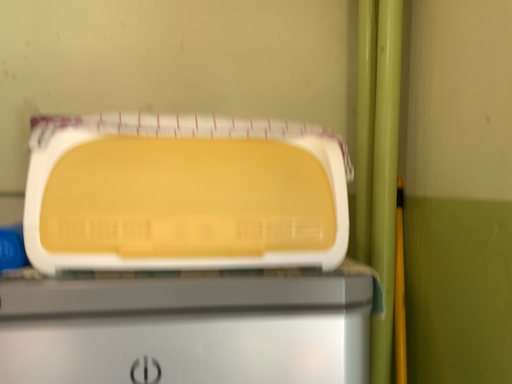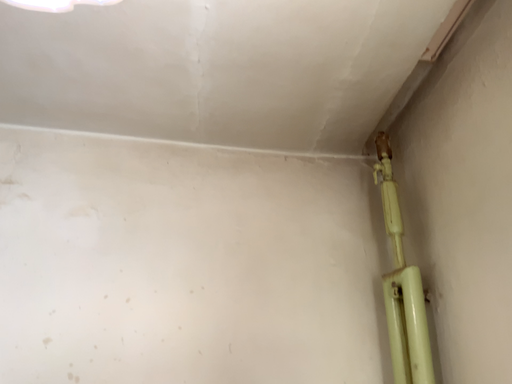
Question: Which way did the camera rotate in the video?

Choices:
 (A) rotated upward
 (B) rotated downward

Answer: (A)